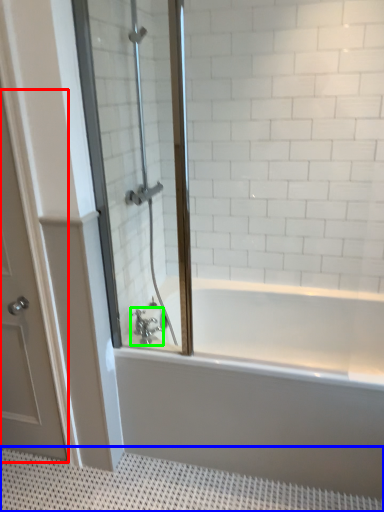
Question: Considering the real-world distances, which object is closest to door (highlighted by a red box)? bath mat (highlighted by a blue box) or tap (highlighted by a green box).

Choices:
 (A) bath mat
 (B) tap

Answer: (A)